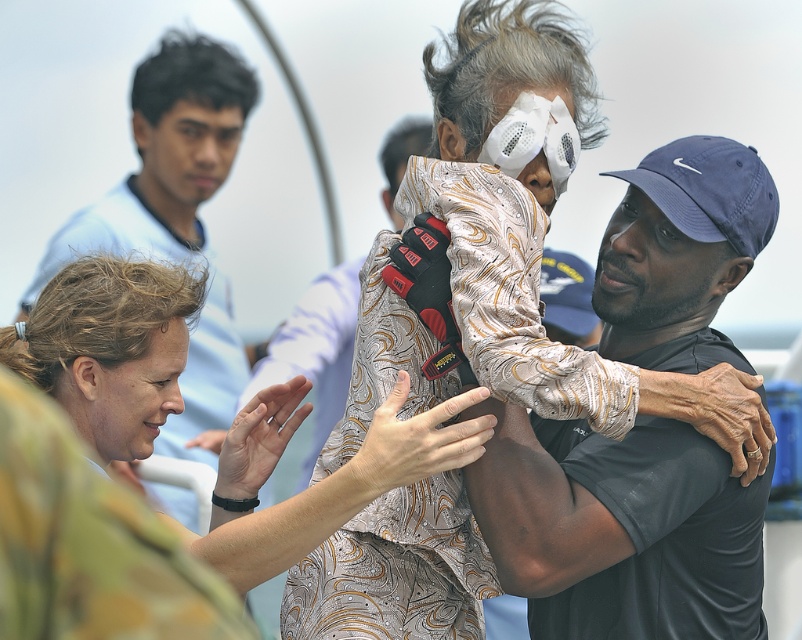
You are a photographer adjusting your camera to focus on two points in the scene. The first point is at coordinates point (223, 144) and the second is at point (357, 269). Which point should you focus on first if you want to capture the closest object in the scene?

Point (223, 144) is closer to the camera than point (357, 269), so you should focus on point (223, 144) first to capture the closest object in the scene.

You are a photographer setting up for a group photo. You have two outfits to consider for the subjects in the scene. The matte floral dress at center and the light blue shirt at upper left. Which outfit has a narrower width?

The matte floral dress at center has a narrower width than the light blue shirt at upper left according to the description.

You are a photographer standing at the scene. You want to take a closeup photo of the matte floral dress at center. Considering your current position, is the distance sufficient for a clear closeup shot?

The matte floral dress at center is 7.95 meters away from viewer. This distance may be too far for a clear closeup shot without a zoom lens.